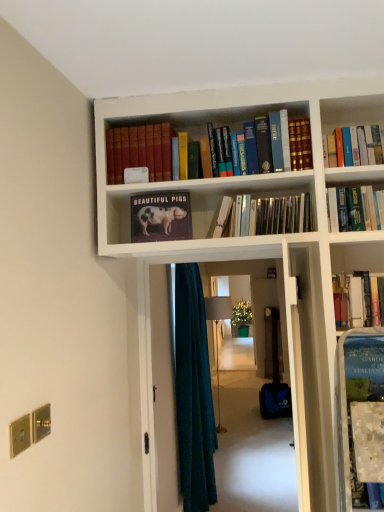
Question: Is hardcover book at center, marked as the third book in a right-to-left arrangement, smaller than teal fabric screen door at center?

Choices:
 (A) no
 (B) yes

Answer: (B)

Question: From the image's perspective, would you say hardcover book at center, marked as the third book in a right-to-left arrangement, is positioned over teal fabric screen door at center?

Choices:
 (A) yes
 (B) no

Answer: (A)

Question: Is there a large distance between hardcover book at center, placed as the third book when sorted from left to right, and teal fabric screen door at center?

Choices:
 (A) no
 (B) yes

Answer: (B)

Question: Is hardcover book at center, placed as the third book when sorted from left to right, placed right next to teal fabric screen door at center?

Choices:
 (A) yes
 (B) no

Answer: (B)

Question: Considering the relative positions of hardcover book at center, marked as the third book in a right-to-left arrangement, and teal fabric screen door at center in the image provided, is hardcover book at center, marked as the third book in a right-to-left arrangement, to the right of teal fabric screen door at center from the viewer's perspective?

Choices:
 (A) no
 (B) yes

Answer: (A)

Question: Would you say matte paper book at center, which appears as the second book when viewed from the left, is inside or outside hardcover book at upper right, positioned as the fifth book in left-to-right order?

Choices:
 (A) outside
 (B) inside

Answer: (A)

Question: From the image's perspective, is matte paper book at center, which appears as the second book when viewed from the left, positioned above or below hardcover book at upper right, positioned as the fifth book in left-to-right order?

Choices:
 (A) above
 (B) below

Answer: (B)

Question: In terms of width, does matte paper book at center, which appears as the fourth book when viewed from the right, look wider or thinner when compared to hardcover book at upper right, the 1th book when ordered from right to left?

Choices:
 (A) wide
 (B) thin

Answer: (B)

Question: Considering their positions, is matte paper book at center, which appears as the fourth book when viewed from the right, located in front of or behind hardcover book at upper right, positioned as the fifth book in left-to-right order?

Choices:
 (A) front
 (B) behind

Answer: (B)

Question: From a real-world perspective, is matte hardcover book at upper center, which is the 1th book from left to right, physically located above or below wooden door at center?

Choices:
 (A) below
 (B) above

Answer: (B)

Question: From the image's perspective, is matte hardcover book at upper center, which is the 1th book from left to right, located above or below wooden door at center?

Choices:
 (A) above
 (B) below

Answer: (A)

Question: Choose the correct answer: Is matte hardcover book at upper center, which is counted as the fifth book, starting from the right, inside wooden door at center or outside it?

Choices:
 (A) outside
 (B) inside

Answer: (A)

Question: In the image, is matte hardcover book at upper center, which is the 1th book from left to right, positioned in front of or behind wooden door at center?

Choices:
 (A) front
 (B) behind

Answer: (A)

Question: From a real-world perspective, is matte paper book at center, which appears as the second book when viewed from the left, above or below matte hardcover book at upper center, which is the 1th book from left to right?

Choices:
 (A) below
 (B) above

Answer: (A)

Question: Visually, is matte paper book at center, which appears as the second book when viewed from the left, positioned to the left or to the right of matte hardcover book at upper center, which is counted as the fifth book, starting from the right?

Choices:
 (A) right
 (B) left

Answer: (A)